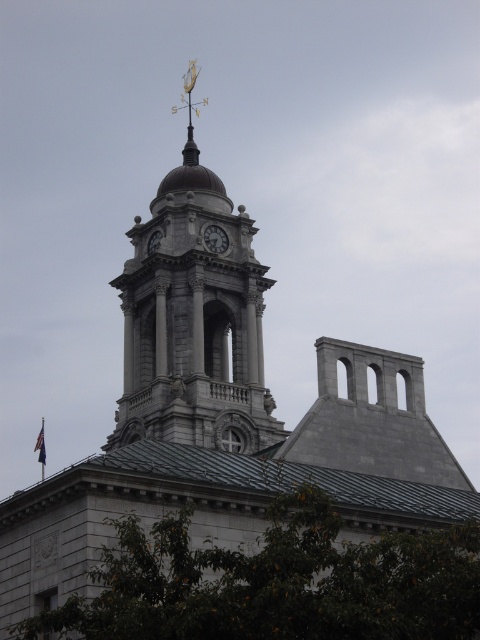
Question: Estimate the real-world distances between objects in this image. Which object is closer to the matte gray clock at center?

Choices:
 (A) blue fabric flag at upper left
 (B) gray stone clock tower at center
 (C) silver metallic clock at center
 (D) green leafy tree at lower center

Answer: (C)

Question: Observing the image, what is the correct spatial positioning of gray stone clock tower at center in reference to blue fabric flag at upper left?

Choices:
 (A) left
 (B) right

Answer: (B)

Question: Is green leafy tree at lower center further to the viewer compared to matte gray clock at center?

Choices:
 (A) yes
 (B) no

Answer: (B)

Question: Which object is the closest to the green leafy tree at lower center?

Choices:
 (A) gray stone clock tower at center
 (B) blue fabric flag at upper left
 (C) silver metallic clock at center
 (D) matte gray clock at center

Answer: (A)

Question: Is blue fabric flag at upper left smaller than silver metallic clock at center?

Choices:
 (A) yes
 (B) no

Answer: (B)

Question: Which of the following is the farthest from the observer?

Choices:
 (A) (40, 433)
 (B) (237, 221)
 (C) (216, 252)
 (D) (124, 614)

Answer: (A)